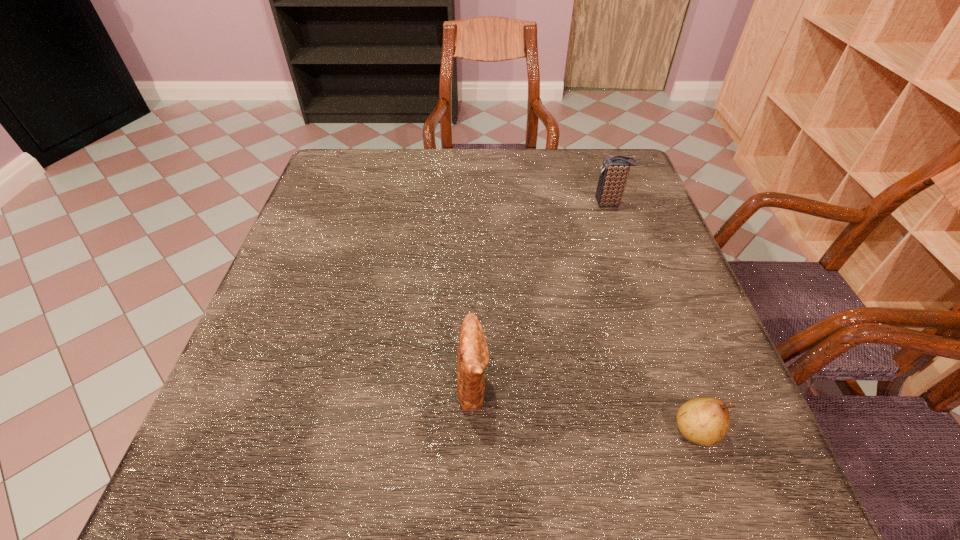
This screenshot has width=960, height=540. Identify the location of object present at the near edge. (704, 421).

Find the location of a particular element. clutch bag positioned at the right edge is located at coordinates (614, 171).

This screenshot has width=960, height=540. Identify the location of pear at the right edge. 704,421.

Find the location of a particular element. This screenshot has width=960, height=540. object located in the near right corner section of the desktop is located at coordinates point(704,421).

In the image, there is a desktop. Where is `vacant space at the far edge`? The width and height of the screenshot is (960, 540). vacant space at the far edge is located at coordinates (493, 173).

The width and height of the screenshot is (960, 540). Find the location of `blank space at the left edge of the desktop`. blank space at the left edge of the desktop is located at coordinates (292, 258).

In order to click on free space at the right edge in this screenshot , I will do `click(622, 232)`.

The height and width of the screenshot is (540, 960). Find the location of `free location at the far left corner of the desktop`. free location at the far left corner of the desktop is located at coordinates tap(335, 183).

This screenshot has width=960, height=540. Identify the location of vacant region at the far right corner. (597, 169).

I want to click on empty space that is in between the pear and the nearer clutch bag, so click(585, 408).